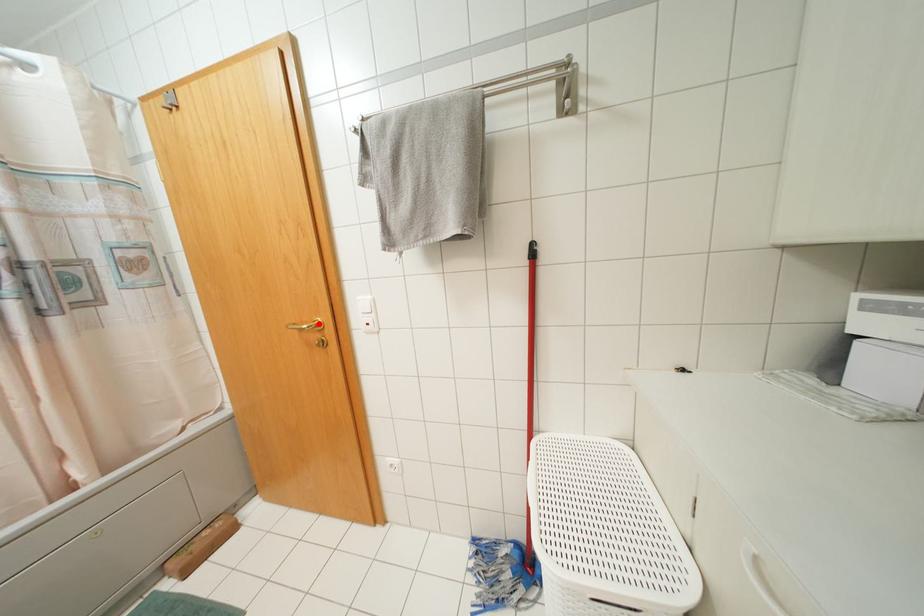
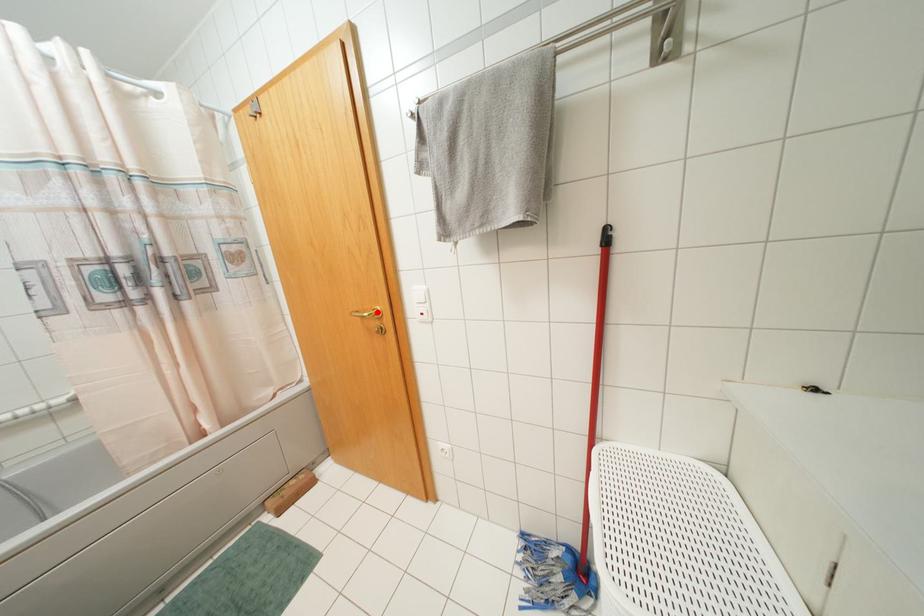
I am providing you with two images of the same scene from different viewpoints. A red point is marked on the first image and another point is marked on the second image. Is the red point in image1 aligned with the point shown in image2?

Yes